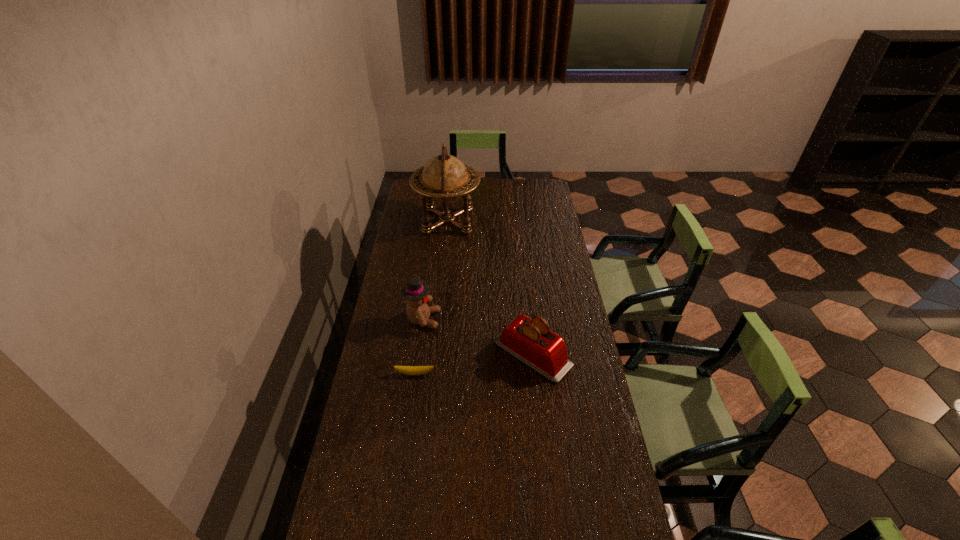
Image resolution: width=960 pixels, height=540 pixels. I want to click on globe, so click(x=445, y=178).

The image size is (960, 540). What are the coordinates of `the farthest object` in the screenshot? It's located at (445, 178).

Where is `the third shortest object`? The image size is (960, 540). the third shortest object is located at coordinates (415, 291).

Locate an element on the screen. toaster is located at coordinates (531, 341).

I want to click on the second shortest object, so click(x=531, y=341).

The width and height of the screenshot is (960, 540). Identify the location of the shortest object. (409, 370).

Find the location of `free space located 0.210m on the front-facing side of the farthest object`. free space located 0.210m on the front-facing side of the farthest object is located at coordinates (520, 221).

Where is `free spot located on the front-facing side of the third shortest object`? free spot located on the front-facing side of the third shortest object is located at coordinates (517, 320).

At what (x,y) coordinates should I click in order to perform the action: click on vacant space located 0.350m on the back of the toaster. Please return your answer as a coordinate pair (x, y). Looking at the image, I should click on (523, 269).

Find the location of `vacant region located on the left of the shortest object`. vacant region located on the left of the shortest object is located at coordinates (364, 374).